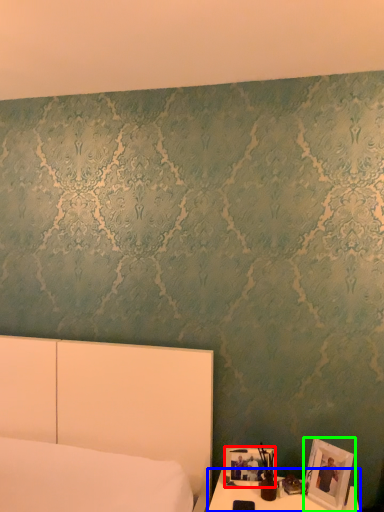
Question: Which is nearer to the picture frame (highlighted by a red box)? table (highlighted by a blue box) or picture frame (highlighted by a green box).

Choices:
 (A) table
 (B) picture frame

Answer: (A)